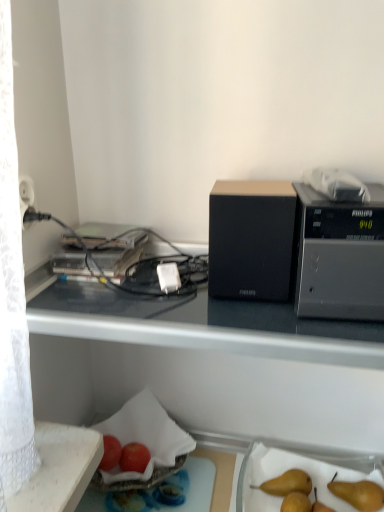
Question: Relative to red matte apple at lower center, placed as the 2th apple when sorted from left to right, is black fabric speaker at center, which is the first appliance in left-to-right order, in front or behind?

Choices:
 (A) front
 (B) behind

Answer: (A)

Question: Is black fabric speaker at center, which is the first appliance in left-to-right order, inside or outside of red matte apple at lower center, which appears as the 1th apple when viewed from the right?

Choices:
 (A) outside
 (B) inside

Answer: (A)

Question: Which object is the closest to the black matte desk at upper center?

Choices:
 (A) brown matte pear at lower right
 (B) white plastic power plug at center
 (C) red matte apple at lower center, which appears as the 1th apple when viewed from the right
 (D) black fabric speaker at center, which is the first appliance in left-to-right order
 (E) black plastic microwave at upper right, the first appliance positioned from the right

Answer: (D)

Question: Which is nearer to the black fabric speaker at center, the 2th appliance viewed from the right?

Choices:
 (A) black plastic microwave at upper right, the first appliance positioned from the right
 (B) black matte desk at upper center
 (C) red matte apple at lower left, the second apple viewed from the right
 (D) brown matte pear at lower right
 (E) red matte apple at lower center, which appears as the 1th apple when viewed from the right

Answer: (A)